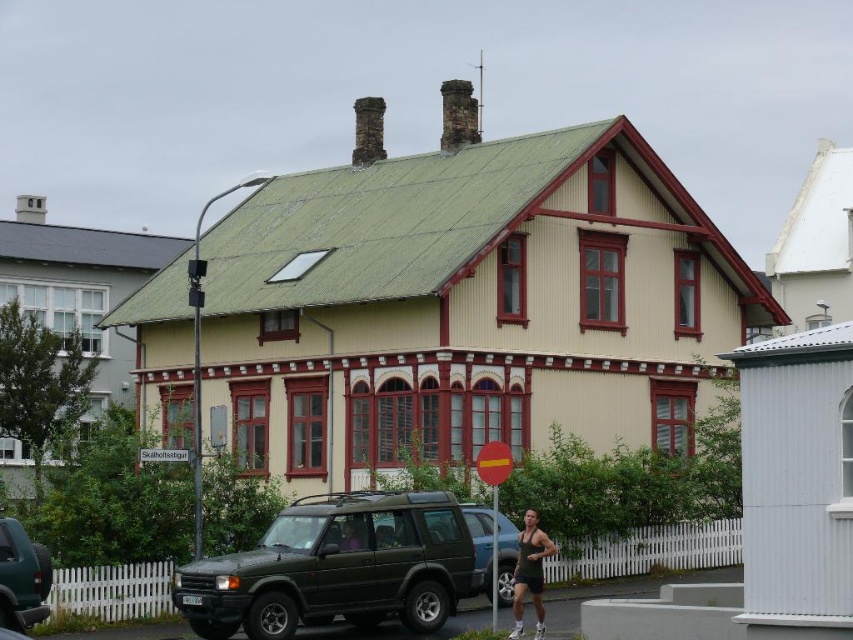
Can you confirm if dark green matte suv at center is shorter than purple fabric shirt at center?

No.

Is dark green matte suv at center to the left of purple fabric shirt at center from the viewer's perspective?

Incorrect, dark green matte suv at center is not on the left side of purple fabric shirt at center.

What do you see at coordinates (480, 547) in the screenshot?
I see `dark green matte suv at center` at bounding box center [480, 547].

Identify the location of dark green matte suv at center. (480, 547).

Can you confirm if matte green suv at center is taller than matte green suv at lower left?

Yes.

Between matte green suv at center and matte green suv at lower left, which one is positioned lower?

matte green suv at center

At what (x,y) coordinates should I click in order to perform the action: click on matte green suv at center. Please return your answer as a coordinate pair (x, y). The height and width of the screenshot is (640, 853). Looking at the image, I should click on (345, 566).

Locate an element on the screen. The width and height of the screenshot is (853, 640). matte green suv at center is located at coordinates (345, 566).

Who is more forward, [276,627] or [350,545]?

Point [276,627] is in front.

Is matte green suv at center further to the viewer compared to purple fabric shirt at center?

No, it is not.

Does point (363, 522) lie behind point (347, 520)?

Yes, point (363, 522) is behind point (347, 520).

Identify the location of matte green suv at center. The width and height of the screenshot is (853, 640). (345, 566).